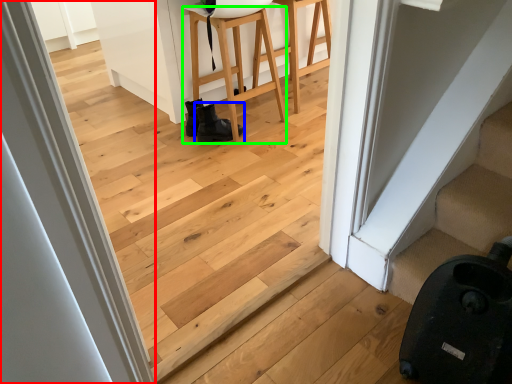
Question: Based on their relative distances, which object is farther from door (highlighted by a red box)? Choose from footwear (highlighted by a blue box) and furniture (highlighted by a green box).

Choices:
 (A) footwear
 (B) furniture

Answer: (B)